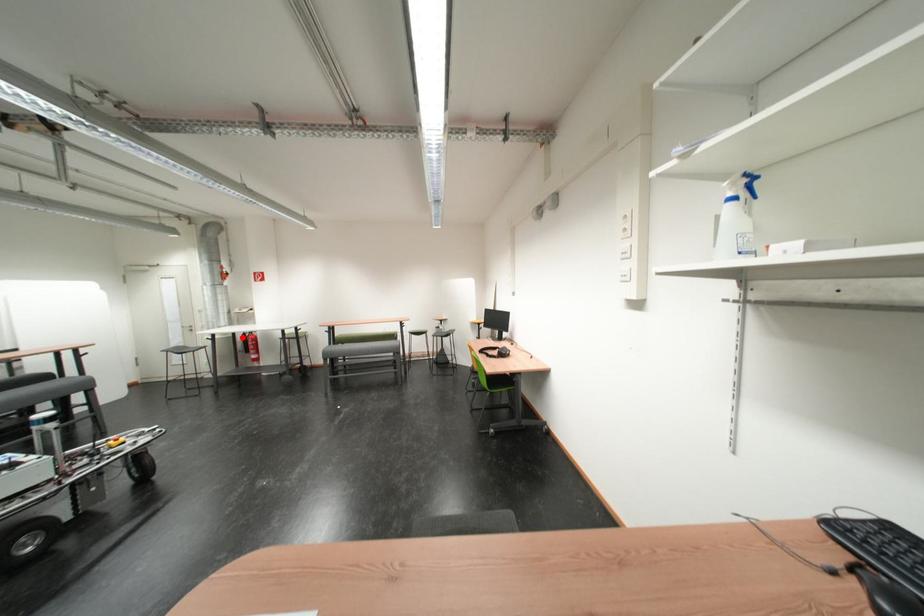
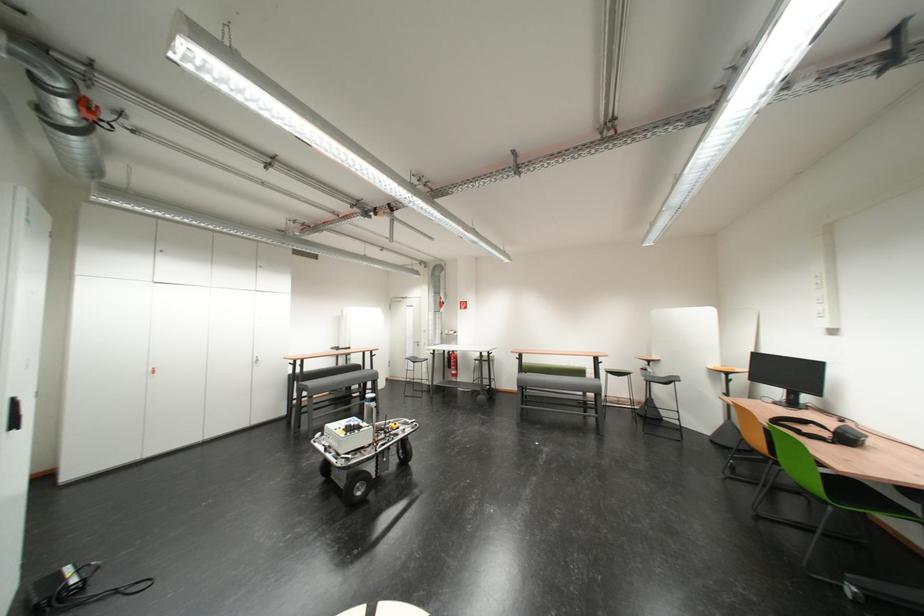
Where in the second image is the point corresponding to the highlighted location from the first image?

(454, 354)